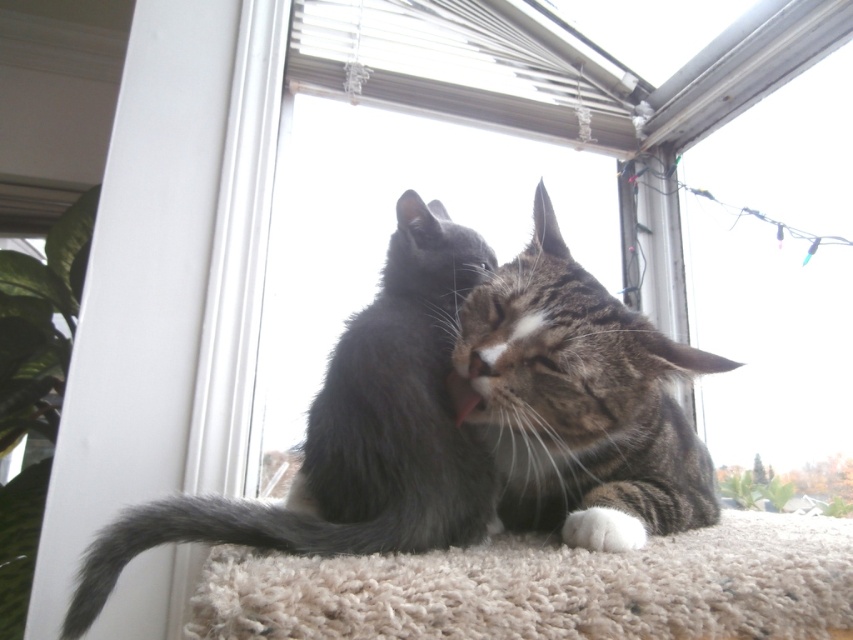
Question: Is the position of gray fluffy cat at center more distant than that of tabby fur cat at center?

Choices:
 (A) yes
 (B) no

Answer: (B)

Question: From the image, what is the correct spatial relationship of gray fluffy cat at center in relation to tabby fur cat at center?

Choices:
 (A) below
 (B) above

Answer: (B)

Question: Which point appears farthest from the camera in this image?

Choices:
 (A) (630, 522)
 (B) (318, 422)

Answer: (A)

Question: Is gray fluffy cat at center to the right of tabby fur cat at center from the viewer's perspective?

Choices:
 (A) yes
 (B) no

Answer: (B)

Question: Among these objects, which one is nearest to the camera?

Choices:
 (A) tabby fur cat at center
 (B) gray fluffy cat at center

Answer: (B)

Question: Which point is closer to the camera taking this photo?

Choices:
 (A) (531, 298)
 (B) (334, 392)

Answer: (B)